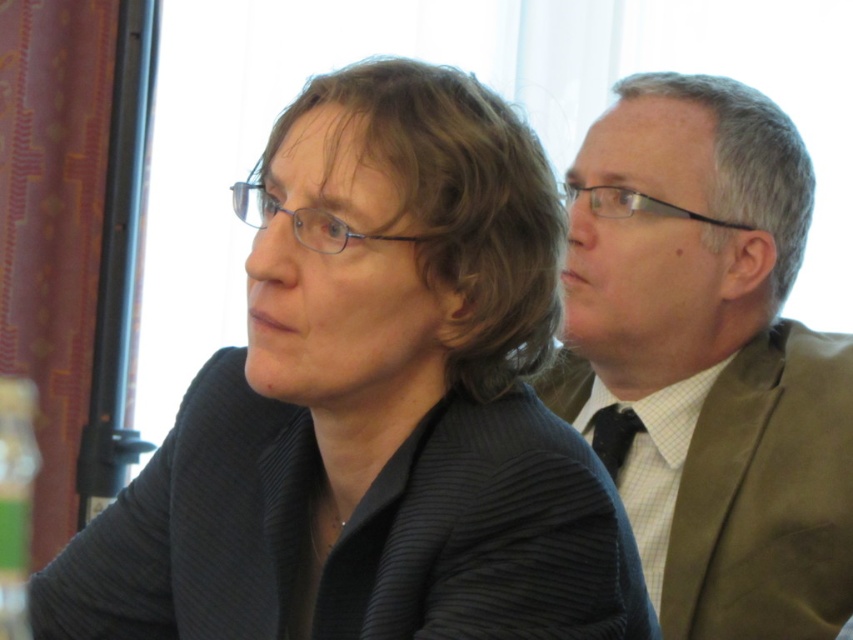
You are a photographer standing at a certain distance from the black textured blazer at center. You want to capture a closeup shot of the blazer while keeping the background slightly blurred. What is the minimum focal length you should use if your camera has a sensor size of 36mm and you want to maintain a depth of field that blurs the background effectively?

To achieve a blurred background with a depth of field, the photographer should use a focal length longer than 50mm. Since the distance to the subject is 28.08 inches, converting this to millimeters gives approximately 713 mm. Using the formula focal length equals sensor size multiplied by distance divided by the desired field of view, a focal length of 85mm or higher would be appropriate to effectively blur the background while focusing on the black textured blazer at center.